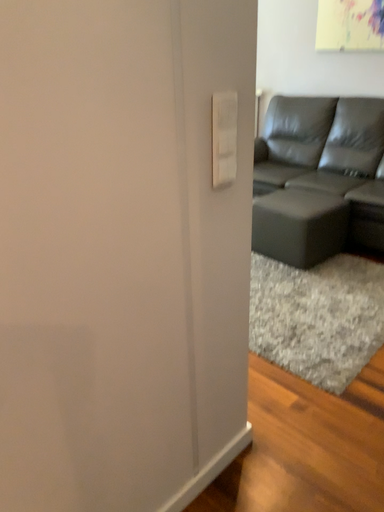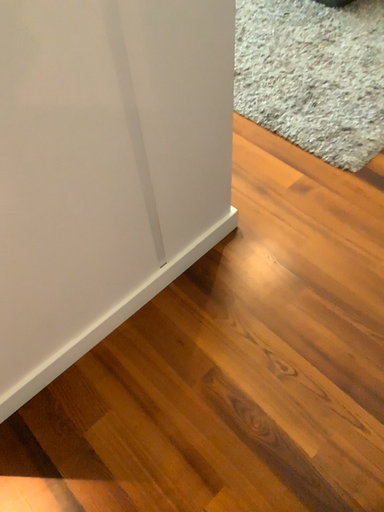
Question: How did the camera likely rotate when shooting the video?

Choices:
 (A) rotated downward
 (B) rotated upward

Answer: (A)